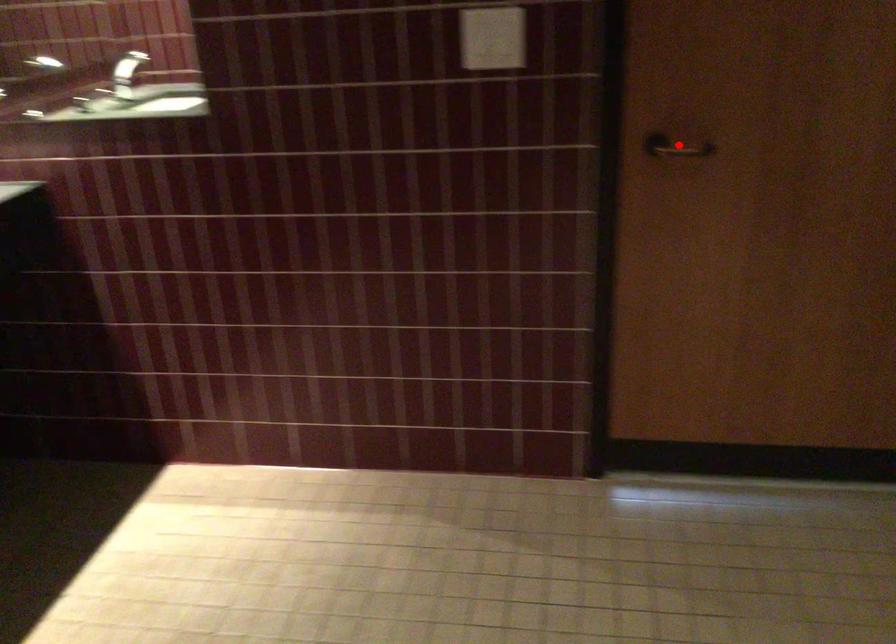
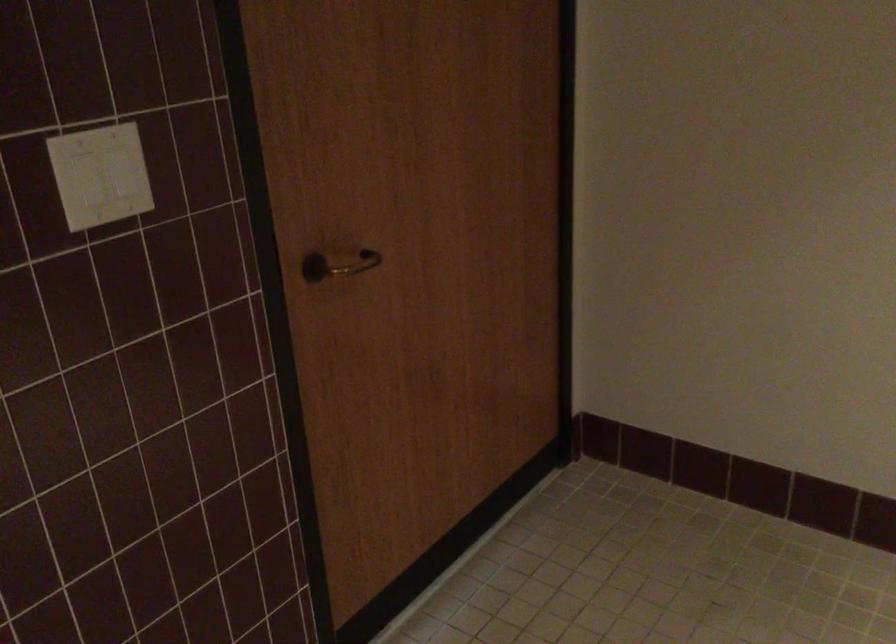
The point at the highlighted location is marked in the first image. Where is the corresponding point in the second image?

(338, 265)